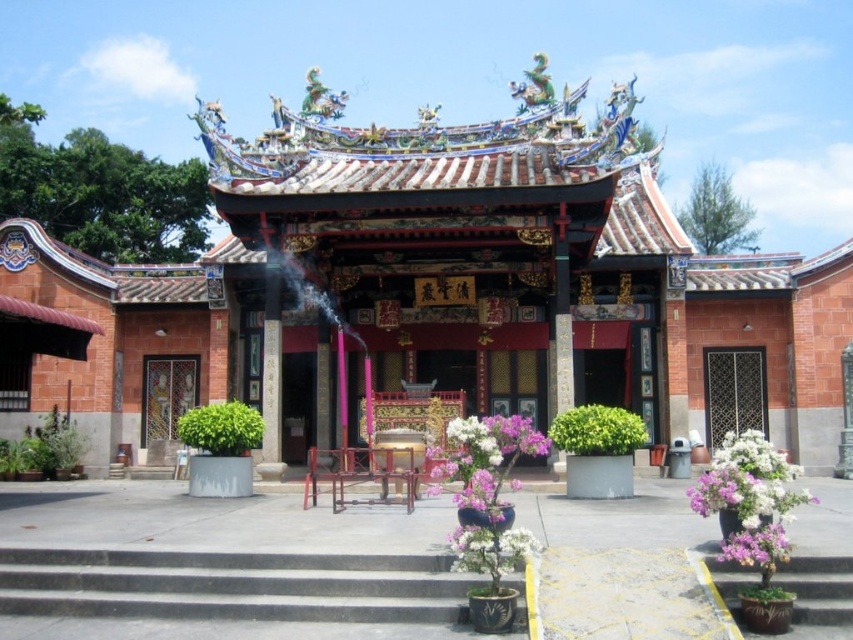
You are a visitor approaching the temple entrance. You see the glossy ceramic altar at center and the smooth concrete stairs at lower right. Which object is positioned higher in the image?

The glossy ceramic altar at center is positioned higher than the smooth concrete stairs at lower right.